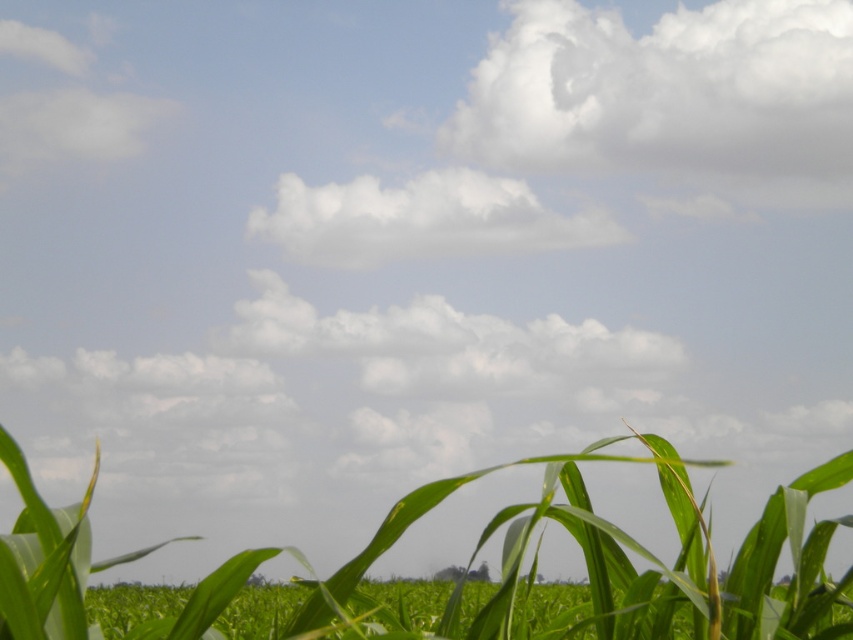
Which is above, green leafy corn at center or white fluffy cloud at center?

Positioned higher is white fluffy cloud at center.

Who is more forward, (817, 627) or (376, 243)?

Point (817, 627)

Does point (82, 568) lie behind point (434, 237)?

No, it is not.

In order to click on green leafy corn at center in this screenshot , I will do `click(611, 566)`.

Who is positioned more to the right, white fluffy cloud at upper center or white fluffy cloud at center?

white fluffy cloud at upper center

Consider the image. Which is below, white fluffy cloud at upper center or white fluffy cloud at center?

white fluffy cloud at center

Based on the photo, who is more forward, (614, 42) or (381, 248)?

Point (381, 248) is more forward.

Image resolution: width=853 pixels, height=640 pixels. What are the coordinates of `white fluffy cloud at upper center` in the screenshot? It's located at (671, 97).

Does green leafy corn at center appear on the left side of white fluffy cloud at upper center?

Indeed, green leafy corn at center is positioned on the left side of white fluffy cloud at upper center.

Can you confirm if green leafy corn at center is bigger than white fluffy cloud at upper center?

No.

Does point (801, 518) come closer to viewer compared to point (563, 29)?

Yes, it is in front of point (563, 29).

I want to click on green leafy corn at center, so click(x=611, y=566).